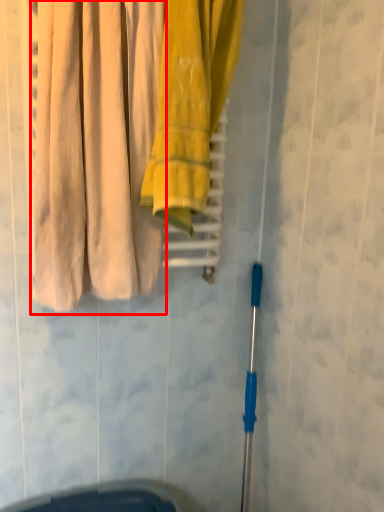
Question: In this image, where is curtain (annotated by the red box) located relative to towel?

Choices:
 (A) left
 (B) right

Answer: (A)